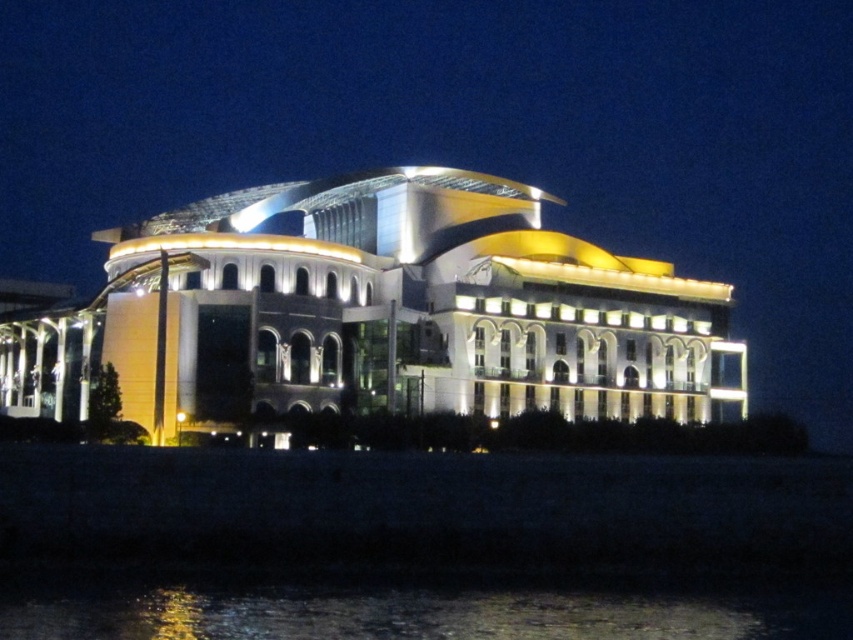
Question: Among these points, which one is nearest to the camera?

Choices:
 (A) (323, 188)
 (B) (447, 637)

Answer: (B)

Question: Is white glossy building at center bigger than glistening water at lower center?

Choices:
 (A) yes
 (B) no

Answer: (A)

Question: Can you confirm if white glossy building at center is positioned to the right of glistening water at lower center?

Choices:
 (A) no
 (B) yes

Answer: (A)

Question: Can you confirm if white glossy building at center is smaller than glistening water at lower center?

Choices:
 (A) no
 (B) yes

Answer: (A)

Question: Which object appears farthest from the camera in this image?

Choices:
 (A) glistening water at lower center
 (B) white glossy building at center

Answer: (B)